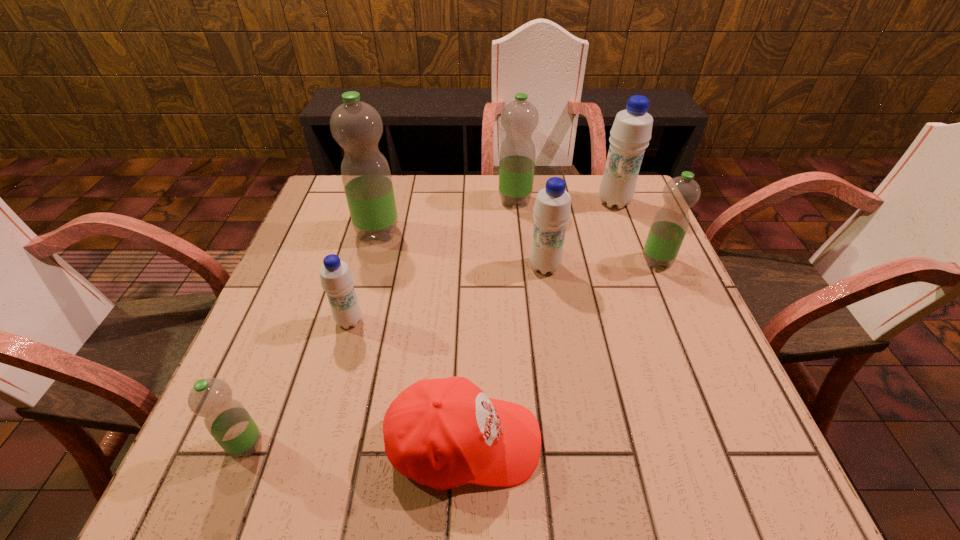
You are a GUI agent. You are given a task and a screenshot of the screen. Output one action in this format:
    pyautogui.click(x=<x>, y=<y>)
    Task: Click on the leftmost blue water bottle
    This screenshot has width=960, height=540.
    Given the screenshot: What is the action you would take?
    pyautogui.click(x=336, y=278)

Identify the location of the nearest blue water bottle. Image resolution: width=960 pixels, height=540 pixels. (336, 278).

Where is `the nearest water bottle`? The height and width of the screenshot is (540, 960). the nearest water bottle is located at coordinates (226, 419).

You are a GUI agent. You are given a task and a screenshot of the screen. Output one action in this format:
    pyautogui.click(x=<x>, y=<y>)
    Task: Click on the smallest green water bottle
    The width and height of the screenshot is (960, 540).
    Given the screenshot: What is the action you would take?
    pyautogui.click(x=226, y=419)

Image resolution: width=960 pixels, height=540 pixels. Find the location of `the shortest object`. the shortest object is located at coordinates (443, 433).

Locate an element on the screen. This screenshot has height=540, width=960. free space located 0.380m on the right of the fifth nearest water bottle is located at coordinates (545, 232).

The width and height of the screenshot is (960, 540). In order to click on free space located on the left of the farthest green water bottle in this screenshot , I will do `click(452, 200)`.

At what (x,y) coordinates should I click in order to perform the action: click on vacant space situated 0.400m on the left of the biggest blue water bottle. Please return your answer as a coordinate pair (x, y). This screenshot has width=960, height=540. Looking at the image, I should click on (x=455, y=202).

The image size is (960, 540). What are the coordinates of `vacant space positioned 0.320m on the front of the second blue water bottle from left to right` in the screenshot? It's located at pos(565,402).

This screenshot has width=960, height=540. Find the location of `vacant space situated on the back of the third biggest green water bottle`. vacant space situated on the back of the third biggest green water bottle is located at coordinates pos(640,221).